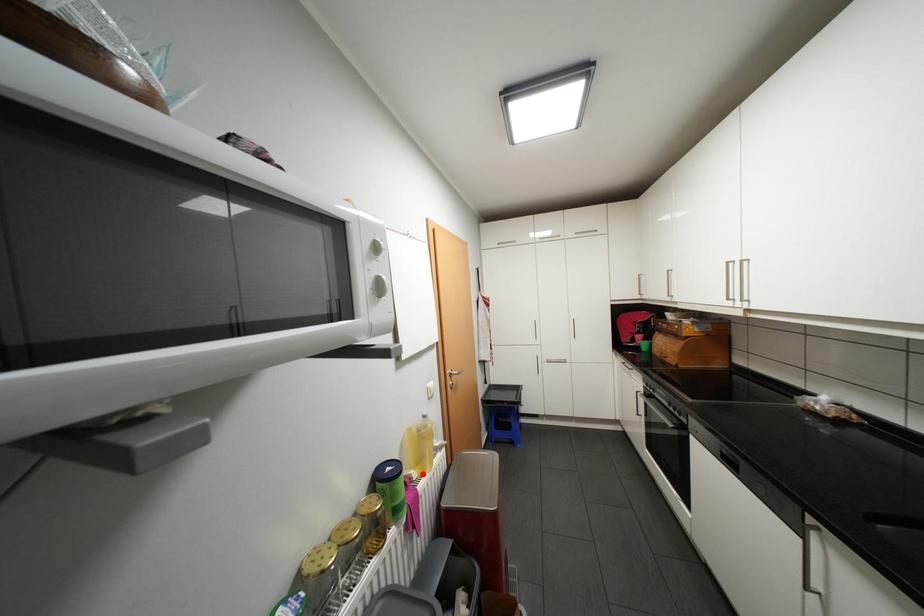
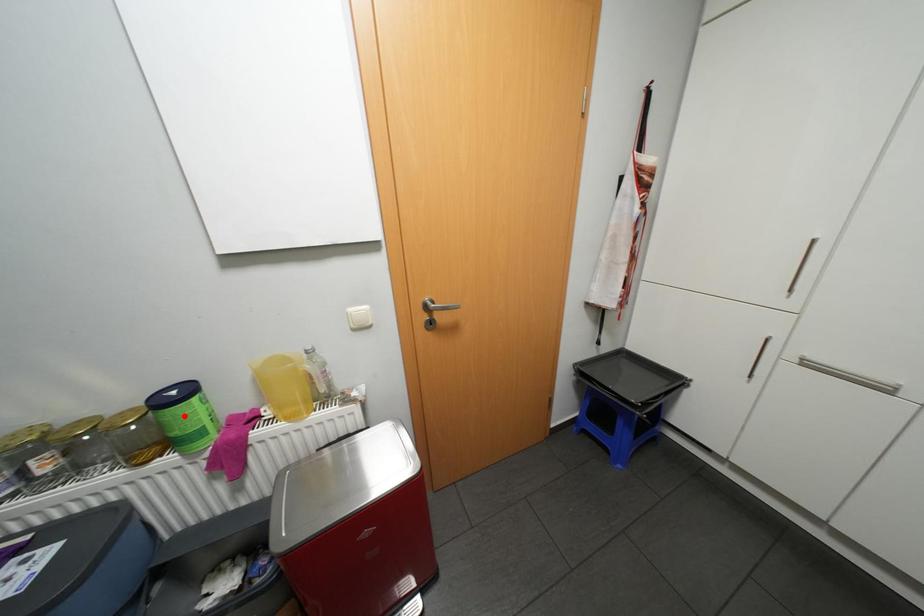
I am providing you with two images of the same scene from different viewpoints. A red point is marked on the first image and another point is marked on the second image. Are the points marked in image1 and image2 representing the same 3D position?

No